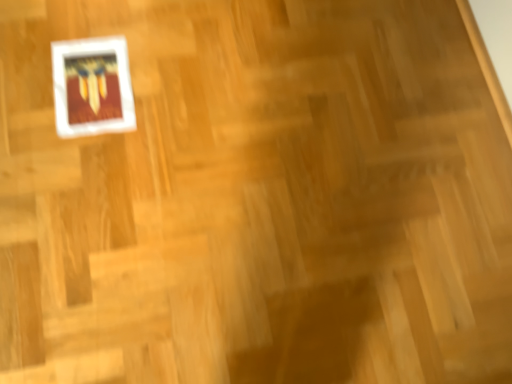
I want to click on spots to the right of white glossy picture frame at upper left, so tap(173, 112).